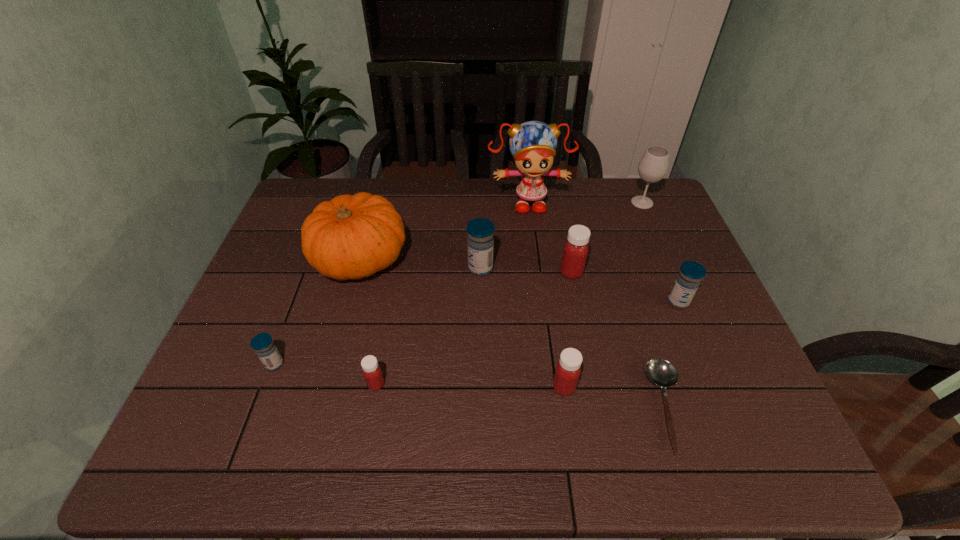
Image resolution: width=960 pixels, height=540 pixels. In order to click on doll in this screenshot , I will do `click(533, 144)`.

What are the coordinates of `wineglass` in the screenshot? It's located at (653, 166).

Image resolution: width=960 pixels, height=540 pixels. I want to click on pumpkin, so click(350, 237).

Image resolution: width=960 pixels, height=540 pixels. In order to click on the biggest blue medicine in this screenshot , I will do `click(480, 243)`.

This screenshot has width=960, height=540. Identify the location of the second blue medicine from left to right. (480, 243).

Find the location of a particular element. Image resolution: width=960 pixels, height=540 pixels. the biggest red medicine is located at coordinates (575, 251).

The width and height of the screenshot is (960, 540). Identify the location of the fifth medicine from left to right. (575, 251).

The width and height of the screenshot is (960, 540). Identify the location of the rightmost blue medicine. (691, 273).

This screenshot has height=540, width=960. In order to click on the rightmost medicine in this screenshot , I will do `click(691, 273)`.

Where is `the second red medicine from right to left`? The height and width of the screenshot is (540, 960). the second red medicine from right to left is located at coordinates (568, 369).